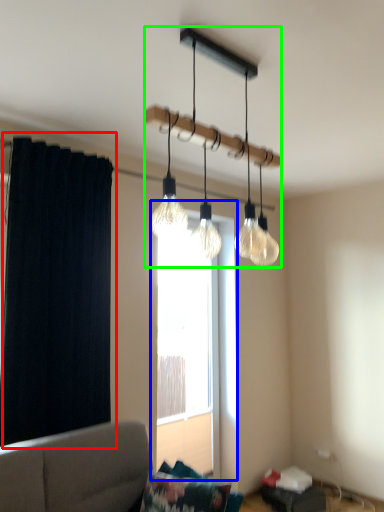
Question: Which is nearer to the curtain (highlighted by a red box)? window (highlighted by a blue box) or lamp (highlighted by a green box).

Choices:
 (A) window
 (B) lamp

Answer: (B)